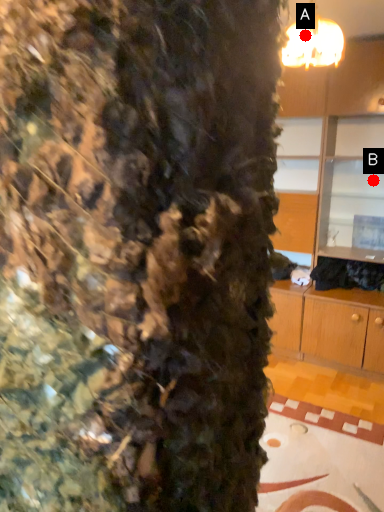
Question: Two points are circled on the image, labeled by A and B beside each circle. Among these points, which one is farthest from the camera?

Choices:
 (A) A is further
 (B) B is further

Answer: (B)